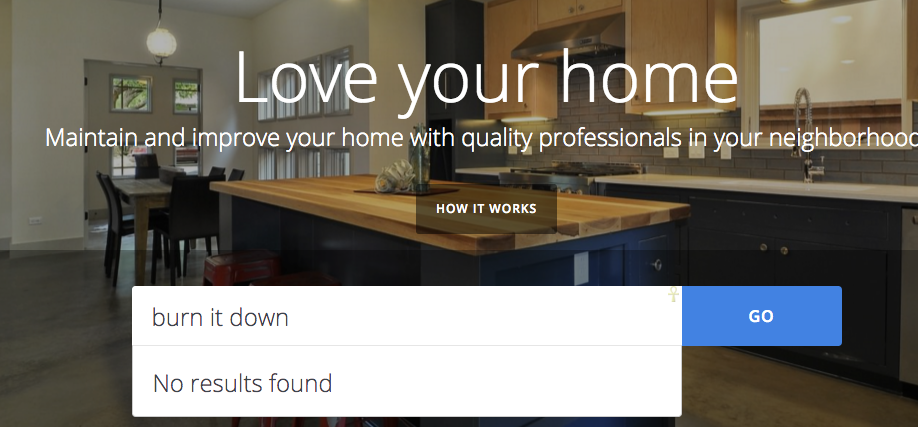
Locate an element on the screen. This screenshot has width=918, height=427. kitchen cabinets is located at coordinates (666, 50), (466, 50).